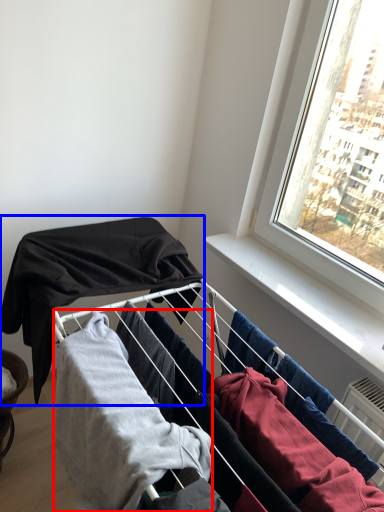
Question: Which object appears farthest to the camera in this image, clothing (highlighted by a red box) or clothing (highlighted by a blue box)?

Choices:
 (A) clothing
 (B) clothing

Answer: (B)